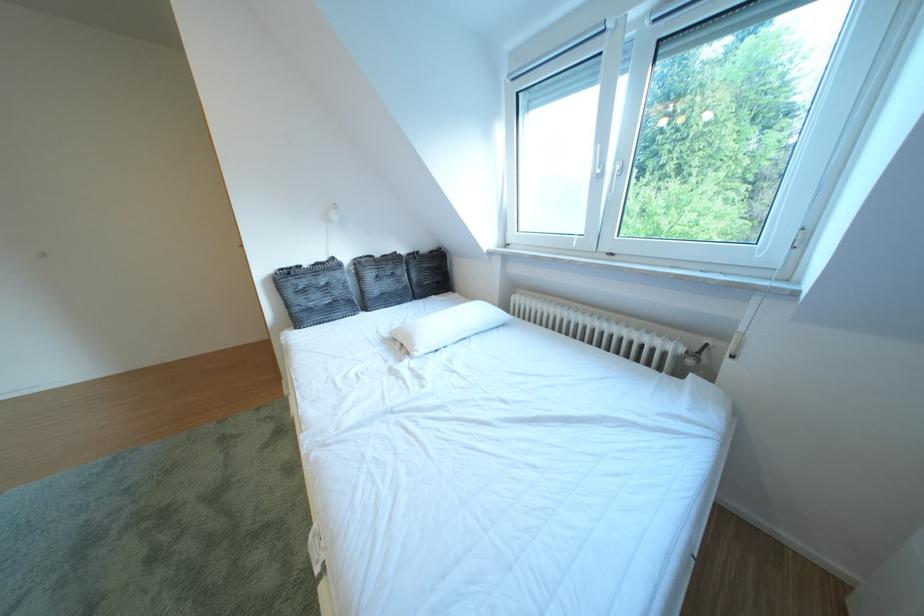
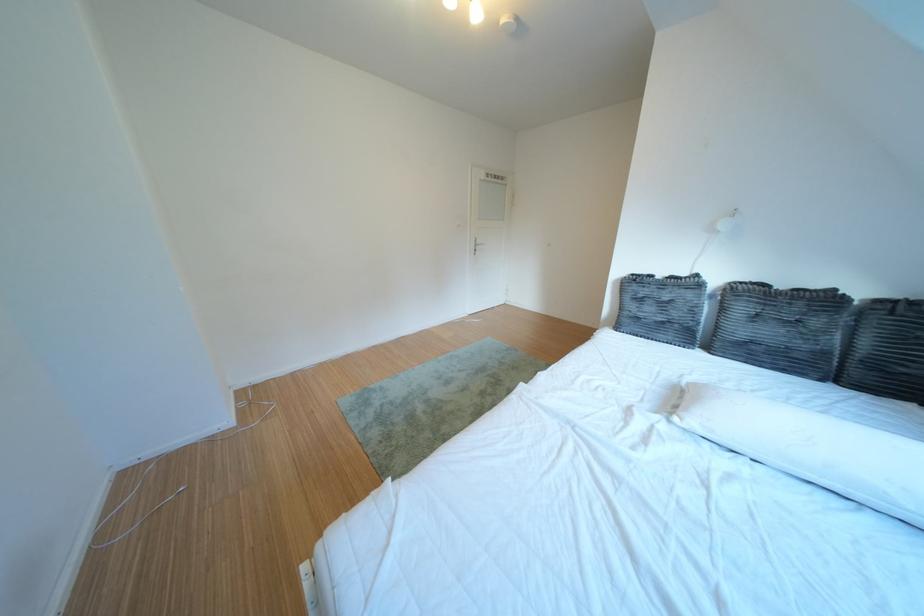
Based on the photo, the first image is from the beginning of the video and the second image is from the end. How did the camera likely rotate when shooting the video?

The rotation direction of the camera is left-down.